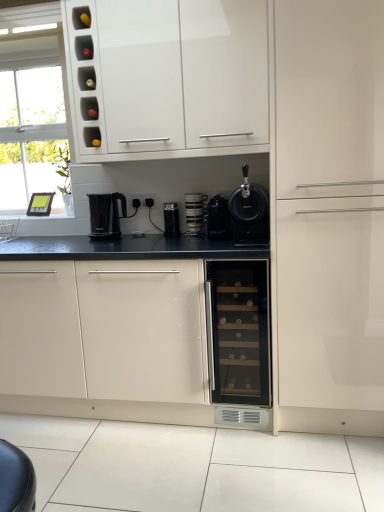
Question: Is matte glass wine cooler at center spatially inside matte white cabinet at right, which ranks as the 1th cabinetry in right-to-left order, or outside of it?

Choices:
 (A) outside
 (B) inside

Answer: (A)

Question: Based on their sizes in the image, would you say matte glass wine cooler at center is bigger or smaller than matte white cabinet at right, which ranks as the 1th cabinetry in right-to-left order?

Choices:
 (A) big
 (B) small

Answer: (B)

Question: Which of these objects is positioned closest to the black plastic toaster at center, placed as the third kitchen appliance when sorted from right to left?

Choices:
 (A) matte white cabinet at right, which ranks as the 1th cabinetry in right-to-left order
 (B) stacked white mugs at center, which is the third kitchen appliance in left-to-right order
 (C) white glossy cabinet at upper center, the second cabinetry positioned from the right
 (D) glossy white wine cooler at center, which is the 1th cabinetry in left-to-right order
 (E) black plastic electric outlet at center

Answer: (B)

Question: Estimate the real-world distances between objects in this image. Which object is farther from the glossy white wine cooler at center, the third cabinetry positioned from the right?

Choices:
 (A) matte glass wine cooler at center
 (B) black plastic kettle at center, placed as the fourth kitchen appliance when sorted from right to left
 (C) black matte coffee machine at center
 (D) black plastic electric outlet at center
 (E) black matte coffee machine at center, the first kitchen appliance when ordered from right to left

Answer: (D)